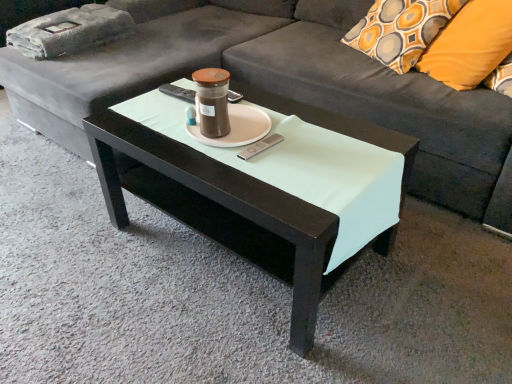
Question: From a real-world perspective, is matte black coffee table at center on top of dark gray fabric couch at center?

Choices:
 (A) no
 (B) yes

Answer: (A)

Question: Can you confirm if matte black coffee table at center is thinner than dark gray fabric couch at center?

Choices:
 (A) no
 (B) yes

Answer: (B)

Question: Is matte black coffee table at center placed right next to dark gray fabric couch at center?

Choices:
 (A) yes
 (B) no

Answer: (B)

Question: From the image's perspective, would you say matte black coffee table at center is shown under dark gray fabric couch at center?

Choices:
 (A) no
 (B) yes

Answer: (B)

Question: Considering the relative sizes of matte black coffee table at center and dark gray fabric couch at center in the image provided, is matte black coffee table at center wider than dark gray fabric couch at center?

Choices:
 (A) no
 (B) yes

Answer: (A)

Question: Is dark gray fabric couch at center located within matte black coffee table at center?

Choices:
 (A) yes
 (B) no

Answer: (B)

Question: Is dark gray fabric couch at center oriented away from matte brown glass candle holder at center?

Choices:
 (A) yes
 (B) no

Answer: (A)

Question: Considering the relative sizes of dark gray fabric couch at center and matte brown glass candle holder at center in the image provided, is dark gray fabric couch at center bigger than matte brown glass candle holder at center?

Choices:
 (A) yes
 (B) no

Answer: (A)

Question: Is dark gray fabric couch at center located outside matte brown glass candle holder at center?

Choices:
 (A) yes
 (B) no

Answer: (A)

Question: From the image's perspective, is dark gray fabric couch at center located beneath matte brown glass candle holder at center?

Choices:
 (A) no
 (B) yes

Answer: (A)

Question: From a real-world perspective, is dark gray fabric couch at center positioned under matte brown glass candle holder at center based on gravity?

Choices:
 (A) yes
 (B) no

Answer: (A)

Question: Would you say dark gray fabric couch at center contains matte brown glass candle holder at center?

Choices:
 (A) yes
 (B) no

Answer: (A)

Question: Considering the relative sizes of orange fabric pillow at upper right and matte black coffee table at center in the image provided, is orange fabric pillow at upper right thinner than matte black coffee table at center?

Choices:
 (A) no
 (B) yes

Answer: (B)